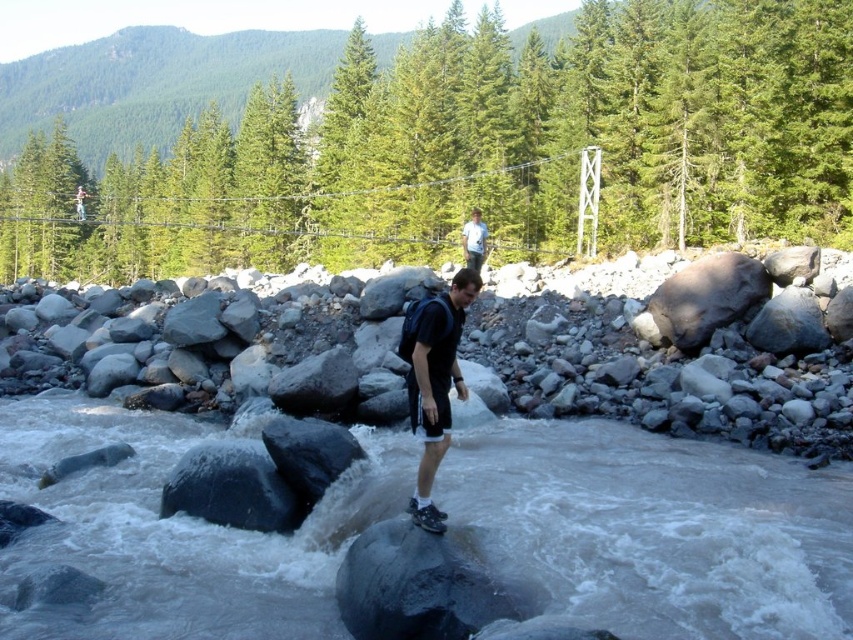
You are a hiker trying to cross the river. You have two options to cross the river. One is to use the suspension bridge in the midground, and the other is to walk on the gray smooth rock at center. Which option is safer?

The suspension bridge in the midground is safer because the gray smooth rock at center is in the middle of the river with turbulent water around it, making it dangerous to walk on.

You are a hiker planning to cross the river using the suspension bridge. You notice a gray rock at center and a white cotton shirt at upper center in the scene. Which object is wider from your perspective?

The gray rock at center is wider than the white cotton shirt at upper center according to the description.